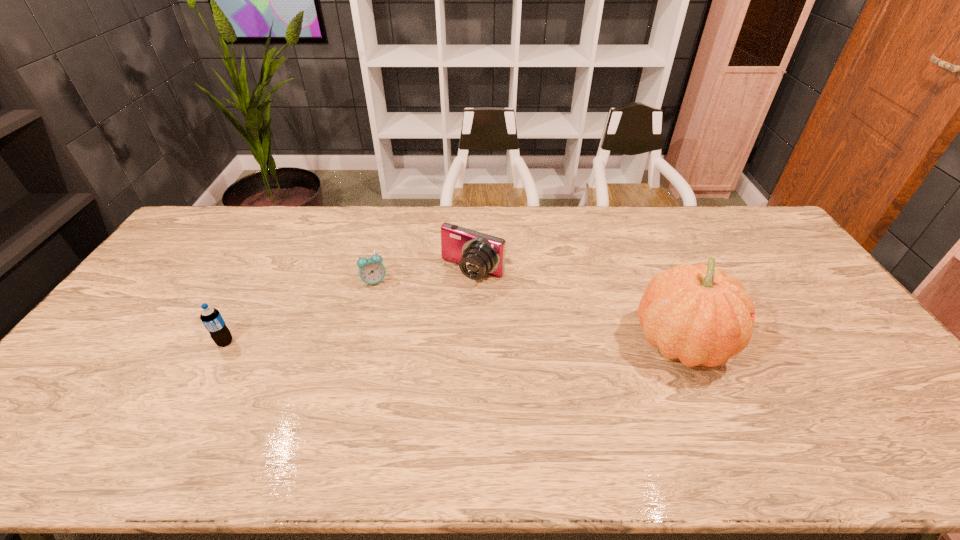
I want to click on object that is the third closest to the third object from left to right, so coord(211,318).

Identify the location of free spot that satisfies the following two spatial constraints: 1. on the front side of the rightmost object; 2. on the carved face of the leftmost object. The image size is (960, 540). (226, 342).

What are the coordinates of `free region that satisfies the following two spatial constraints: 1. on the back side of the leftmost object; 2. on the right side of the second object from right to left` in the screenshot? It's located at (263, 273).

Find the location of a particular element. This screenshot has width=960, height=540. free location that satisfies the following two spatial constraints: 1. on the front side of the pumpkin; 2. on the carved face of the shortest object is located at coordinates (359, 342).

At what (x,y) coordinates should I click in order to perform the action: click on vacant space that satisfies the following two spatial constraints: 1. on the back side of the second object from left to right; 2. on the left side of the camera. Please return your answer as a coordinate pair (x, y). Looking at the image, I should click on (377, 273).

What are the coordinates of `free space in the image that satisfies the following two spatial constraints: 1. on the back side of the soda bottle; 2. on the left side of the camera` in the screenshot? It's located at (263, 273).